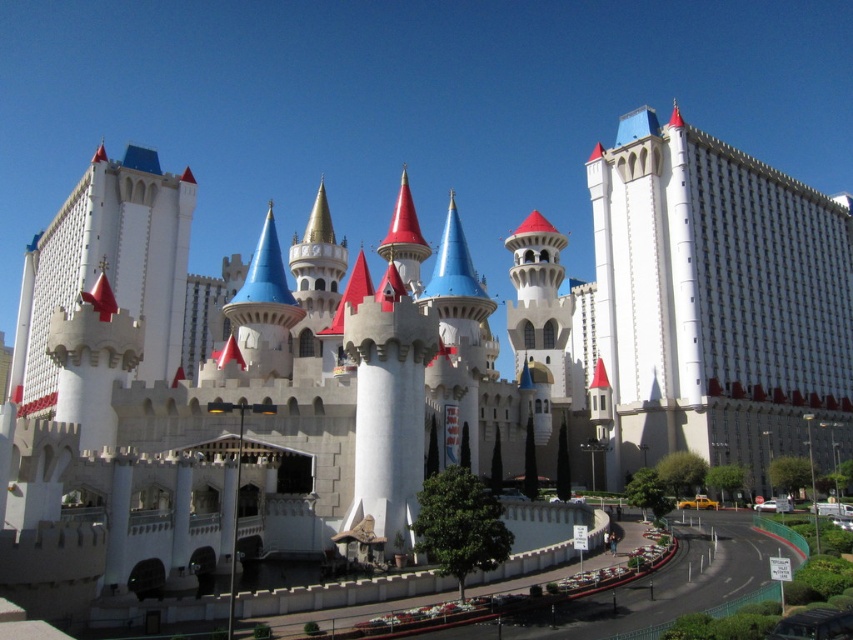
Question: Which object is closer to the camera taking this photo?

Choices:
 (A) white stone castle at left
 (B) white smooth building at right

Answer: (A)

Question: Does white smooth building at right have a lesser width compared to white stone castle at left?

Choices:
 (A) yes
 (B) no

Answer: (A)

Question: Among these objects, which one is nearest to the camera?

Choices:
 (A) white smooth building at right
 (B) white stone castle at left

Answer: (B)

Question: Does white smooth building at right have a greater width compared to white stone castle at left?

Choices:
 (A) no
 (B) yes

Answer: (A)

Question: Does white smooth building at right have a greater width compared to white stone castle at left?

Choices:
 (A) yes
 (B) no

Answer: (B)